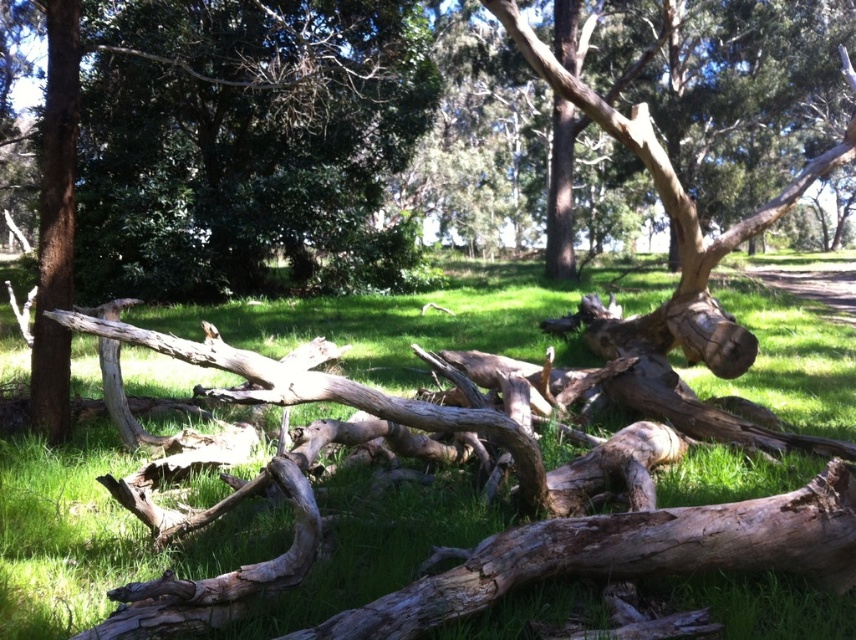
From the picture: You are a hiker who wants to cross over the drab brown log at center and the smooth brown tree trunk at center. Which one is taller and easier to step over?

The drab brown log at center has a greater height compared to the smooth brown tree trunk at center, so it is taller and easier to step over.